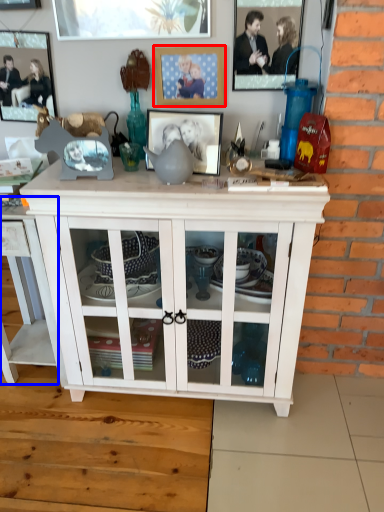
Question: Which of the following is the closest to the observer, picture frame (highlighted by a red box) or table (highlighted by a blue box)?

Choices:
 (A) picture frame
 (B) table

Answer: (B)